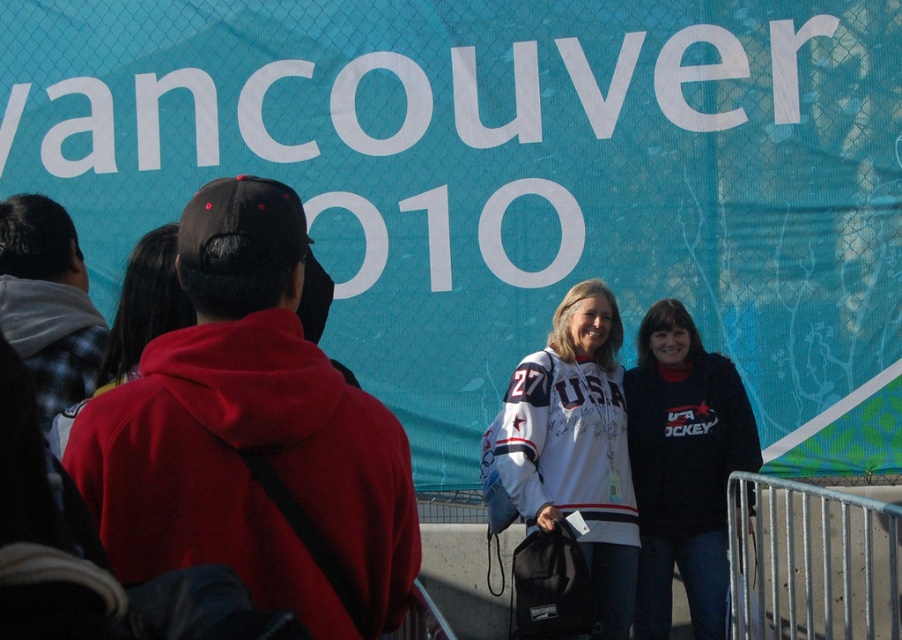
Question: Does white jersey at center have a greater width compared to black fleece sweatshirt at center?

Choices:
 (A) yes
 (B) no

Answer: (A)

Question: Which of the following is the closest to the observer?

Choices:
 (A) (155, 384)
 (B) (688, 384)
 (C) (621, 388)

Answer: (A)

Question: Which point is farther from the camera taking this photo?

Choices:
 (A) (283, 372)
 (B) (549, 369)

Answer: (B)

Question: Estimate the real-world distances between objects in this image. Which object is closer to the black fleece sweatshirt at center?

Choices:
 (A) red fleece sweatshirt at left
 (B) white jersey at center

Answer: (B)

Question: Can you confirm if white jersey at center is positioned above black fleece sweatshirt at center?

Choices:
 (A) no
 (B) yes

Answer: (B)

Question: Does white jersey at center appear over black fleece sweatshirt at center?

Choices:
 (A) yes
 (B) no

Answer: (A)